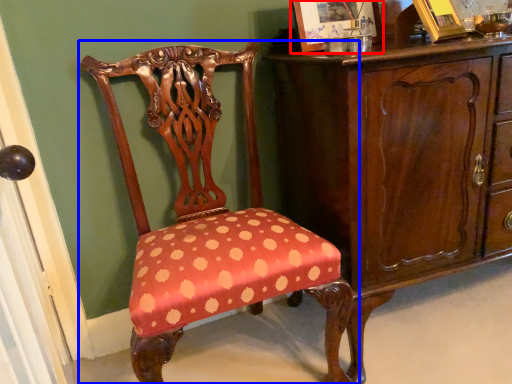
Question: Among these objects, which one is farthest to the camera, picture frame (highlighted by a red box) or chair (highlighted by a blue box)?

Choices:
 (A) picture frame
 (B) chair

Answer: (A)